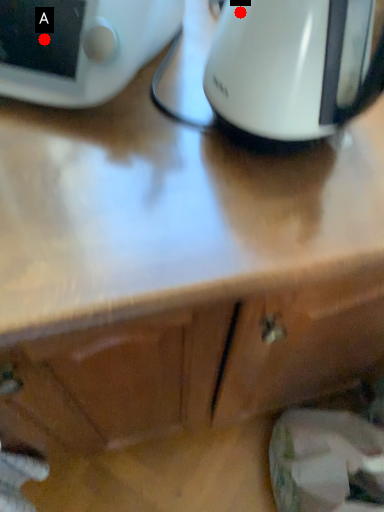
Question: Two points are circled on the image, labeled by A and B beside each circle. Which point is closer to the camera?

Choices:
 (A) A is closer
 (B) B is closer

Answer: (B)